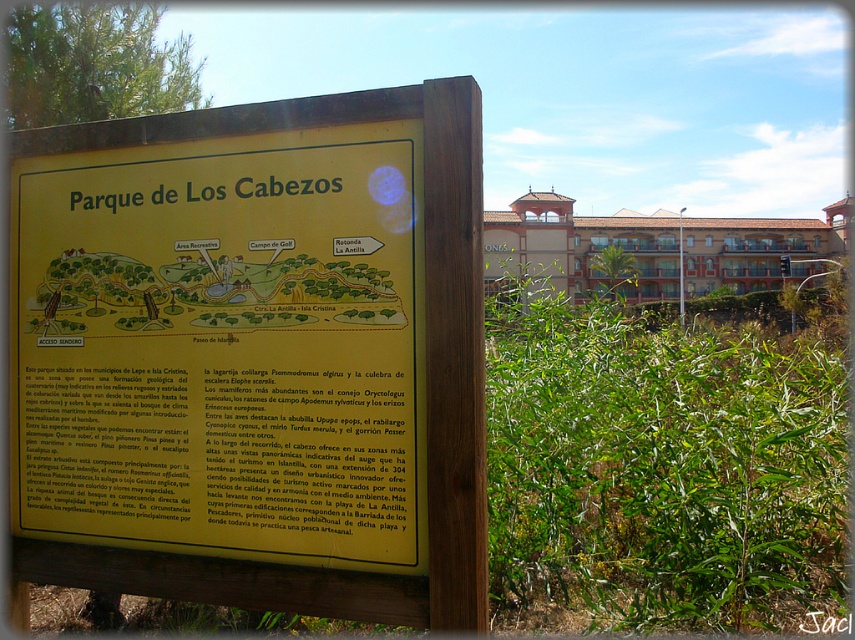
You are a park visitor holding a 1.5 meter wide picnic blanket. You want to place it near the yellow matte sign at center and the green leafy plant at center. Based on their sizes, which object can you place the blanket next to without overlapping?

The yellow matte sign at center occupies less space than the green leafy plant at center, so you can place the blanket next to the green leafy plant at center since it has more space available.

You are standing in front of the Parque de Los Cabezos signboard and notice a green leafy plant nearby. Which object has a wider width between the yellow matte sign at center and the green leafy plant at center?

The green leafy plant at center has a greater width than the yellow matte sign at center.